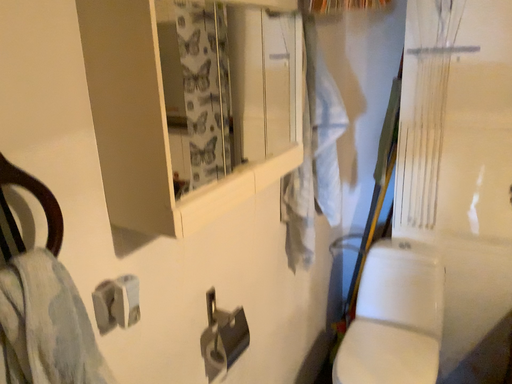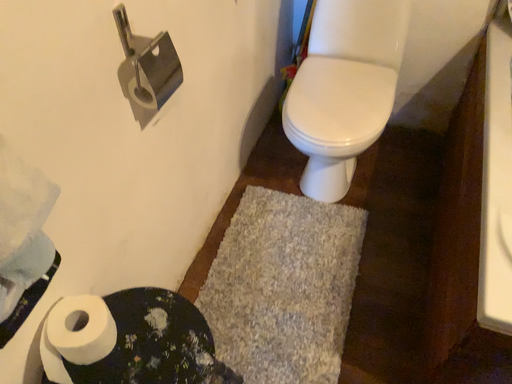
Question: Which way did the camera rotate in the video?

Choices:
 (A) rotated downward
 (B) rotated upward

Answer: (A)